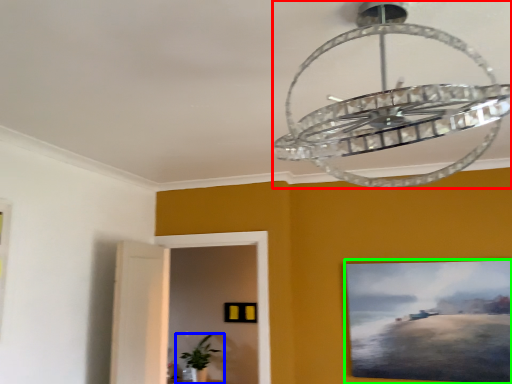
Question: Considering the real-world distances, which object is closest to lamp (highlighted by a red box)? houseplant (highlighted by a blue box) or picture frame (highlighted by a green box).

Choices:
 (A) houseplant
 (B) picture frame

Answer: (B)